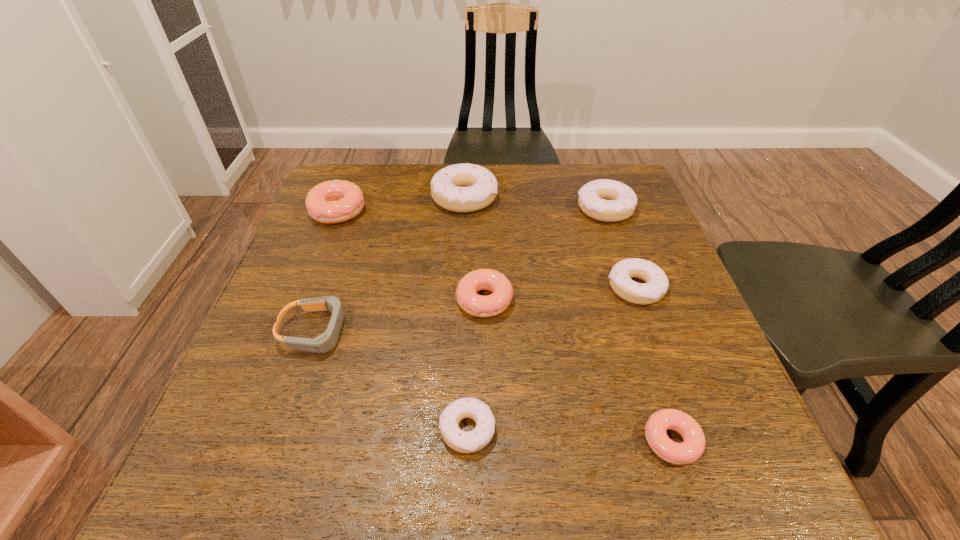
You are a GUI agent. You are given a task and a screenshot of the screen. Output one action in this format:
    pyautogui.click(x=<x>, y=<y>)
    Task: Click on the free space at the near right corner of the desktop
    
    Given the screenshot: What is the action you would take?
    tap(687, 478)

Where is `empty space that is in between the nearest white doughnut and the biggest white doughnut`? The height and width of the screenshot is (540, 960). empty space that is in between the nearest white doughnut and the biggest white doughnut is located at coordinates (466, 314).

You are a GUI agent. You are given a task and a screenshot of the screen. Output one action in this format:
    pyautogui.click(x=<x>, y=<y>)
    Task: Click on the free space between the third farthest white doughnut and the second farthest pink doughnut
    The image size is (960, 540).
    Given the screenshot: What is the action you would take?
    pyautogui.click(x=560, y=294)

Locate an element on the screen. The image size is (960, 540). vacant region between the third biggest white doughnut and the second pink doughnut from right to left is located at coordinates click(x=560, y=294).

The width and height of the screenshot is (960, 540). I want to click on empty location between the second biggest white doughnut and the second nearest pink doughnut, so click(x=544, y=255).

Locate an element on the screen. This screenshot has height=540, width=960. empty location between the biggest white doughnut and the nearest white doughnut is located at coordinates (466, 314).

In order to click on blank region between the second biggest white doughnut and the smallest pink doughnut in this screenshot , I will do `click(638, 325)`.

Find the location of a particular element. Image resolution: width=960 pixels, height=540 pixels. blank region between the nearest pink doughnut and the leftmost doughnut is located at coordinates (505, 326).

Find the location of `vacant region between the third smallest white doughnut and the nearest white doughnut`. vacant region between the third smallest white doughnut and the nearest white doughnut is located at coordinates (537, 319).

Locate an element on the screen. blank region between the nearest white doughnut and the leftmost pink doughnut is located at coordinates (402, 320).